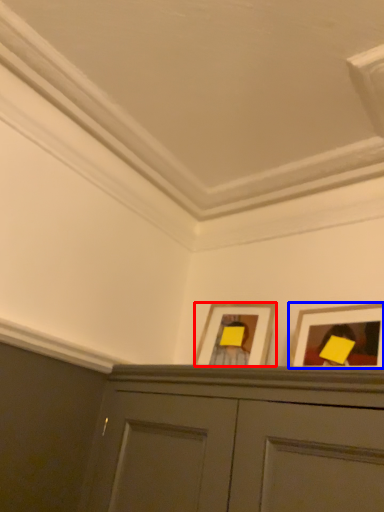
Question: Which point is further to the camera, picture frame (highlighted by a red box) or picture frame (highlighted by a blue box)?

Choices:
 (A) picture frame
 (B) picture frame

Answer: (A)